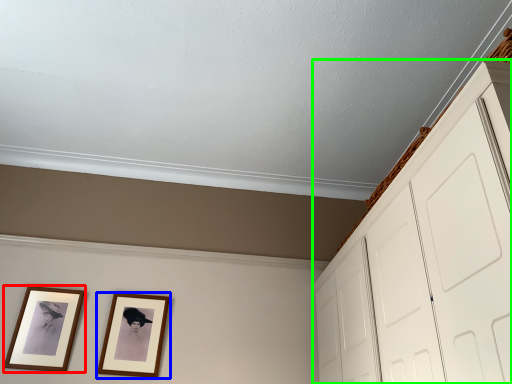
Question: Estimate the real-world distances between objects in this image. Which object is closer to picture frame (highlighted by a red box), picture frame (highlighted by a blue box) or dresser (highlighted by a green box)?

Choices:
 (A) picture frame
 (B) dresser

Answer: (A)